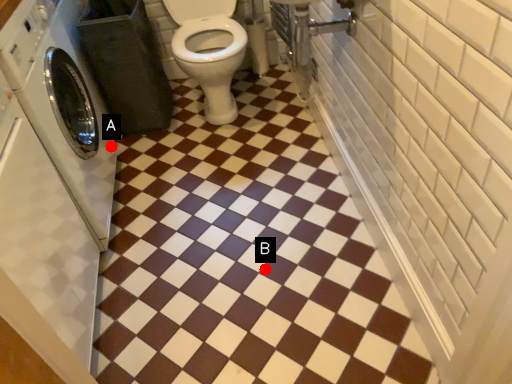
Question: Two points are circled on the image, labeled by A and B beside each circle. Which point is closer to the camera taking this photo?

Choices:
 (A) A is closer
 (B) B is closer

Answer: (B)